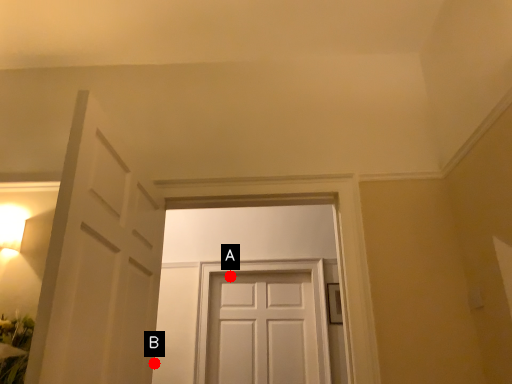
Question: Two points are circled on the image, labeled by A and B beside each circle. Among these points, which one is farthest from the camera?

Choices:
 (A) A is further
 (B) B is further

Answer: (A)